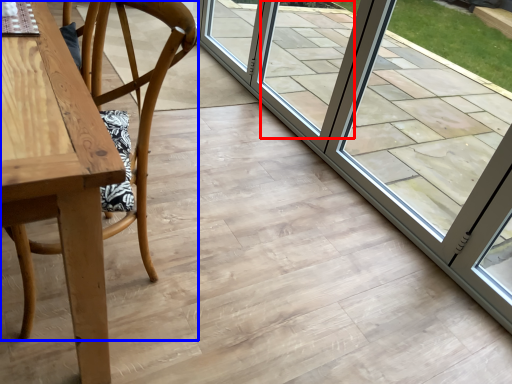
Question: Which point is further to the camera, window (highlighted by a red box) or chair (highlighted by a blue box)?

Choices:
 (A) window
 (B) chair

Answer: (A)